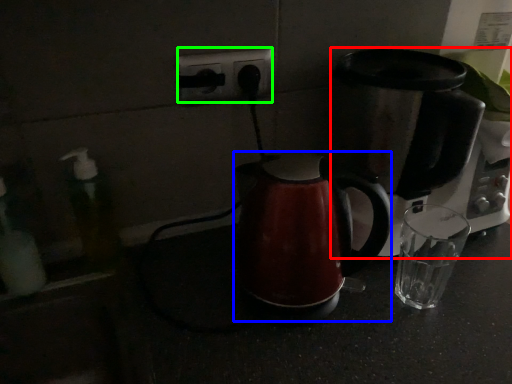
Question: Which object is positioned farthest from coffee maker (highlighted by a red box)? Select from kettle (highlighted by a blue box) and electric outlet (highlighted by a green box).

Choices:
 (A) kettle
 (B) electric outlet

Answer: (B)